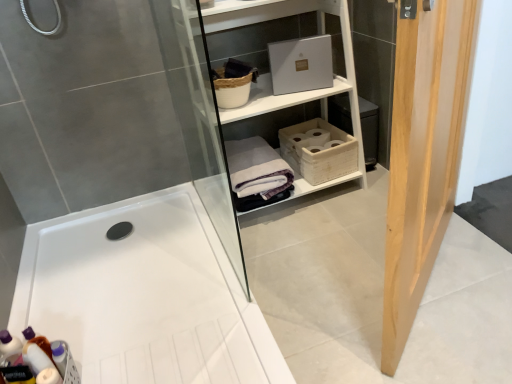
Question: Is light wood door at right inside the boundaries of white woven basket at center, marked as the 1th basket in a right-to-left arrangement, or outside?

Choices:
 (A) outside
 (B) inside

Answer: (A)

Question: Based on their positions, is light wood door at right located to the left or right of white woven basket at center, marked as the 1th basket in a right-to-left arrangement?

Choices:
 (A) left
 (B) right

Answer: (B)

Question: Which of these objects is positioned closest to the translucent plastic bottles at lower left?

Choices:
 (A) woven brown basket at upper center, placed as the first basket when sorted from left to right
 (B) white cotton bath towel at center
 (C) light wood door at right
 (D) white woven basket at center, which is the 1th basket in bottom-to-top order
 (E) white glossy bathtub at center

Answer: (E)

Question: Which is farther from the white cotton bath towel at center?

Choices:
 (A) woven brown basket at upper center, which is the second basket in bottom-to-top order
 (B) translucent plastic bottles at lower left
 (C) white woven basket at center, marked as the 1th basket in a right-to-left arrangement
 (D) white matte shelf at upper center
 (E) light wood door at right

Answer: (B)